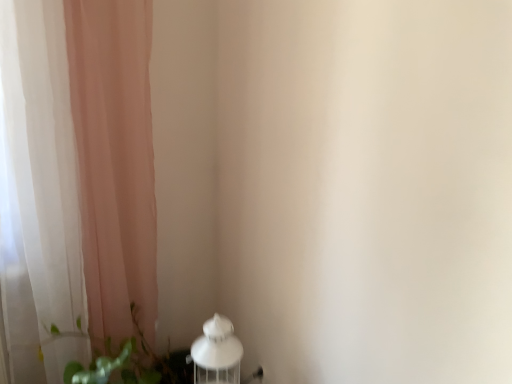
Question: Does white matte table lamp at lower left have a lesser height compared to green leafy plant at lower left?

Choices:
 (A) no
 (B) yes

Answer: (B)

Question: Is white matte table lamp at lower left turned away from green leafy plant at lower left?

Choices:
 (A) no
 (B) yes

Answer: (A)

Question: Is white matte table lamp at lower left in contact with green leafy plant at lower left?

Choices:
 (A) yes
 (B) no

Answer: (B)

Question: Is green leafy plant at lower left surrounded by white matte table lamp at lower left?

Choices:
 (A) no
 (B) yes

Answer: (A)

Question: Can you confirm if white matte table lamp at lower left is thinner than green leafy plant at lower left?

Choices:
 (A) no
 (B) yes

Answer: (B)

Question: Do you think green leafy plant at lower left is within sheer pink curtain at left, or outside of it?

Choices:
 (A) outside
 (B) inside

Answer: (A)

Question: Looking at the image, does green leafy plant at lower left seem bigger or smaller compared to sheer pink curtain at left?

Choices:
 (A) big
 (B) small

Answer: (B)

Question: In the image, is green leafy plant at lower left on the left side or the right side of sheer pink curtain at left?

Choices:
 (A) left
 (B) right

Answer: (B)

Question: Considering the positions of green leafy plant at lower left and sheer pink curtain at left in the image, is green leafy plant at lower left taller or shorter than sheer pink curtain at left?

Choices:
 (A) tall
 (B) short

Answer: (B)

Question: From a real-world perspective, is sheer pink curtain at left positioned above or below white matte table lamp at lower left?

Choices:
 (A) below
 (B) above

Answer: (B)

Question: In the image, is sheer pink curtain at left positioned in front of or behind white matte table lamp at lower left?

Choices:
 (A) front
 (B) behind

Answer: (A)

Question: Looking at their shapes, would you say sheer pink curtain at left is wider or thinner than white matte table lamp at lower left?

Choices:
 (A) thin
 (B) wide

Answer: (B)

Question: In terms of size, does sheer pink curtain at left appear bigger or smaller than white matte table lamp at lower left?

Choices:
 (A) big
 (B) small

Answer: (A)

Question: Is sheer pink curtain at left to the left or to the right of green leafy plant at lower left in the image?

Choices:
 (A) right
 (B) left

Answer: (B)

Question: From the image's perspective, is sheer pink curtain at left located above or below green leafy plant at lower left?

Choices:
 (A) below
 (B) above

Answer: (B)